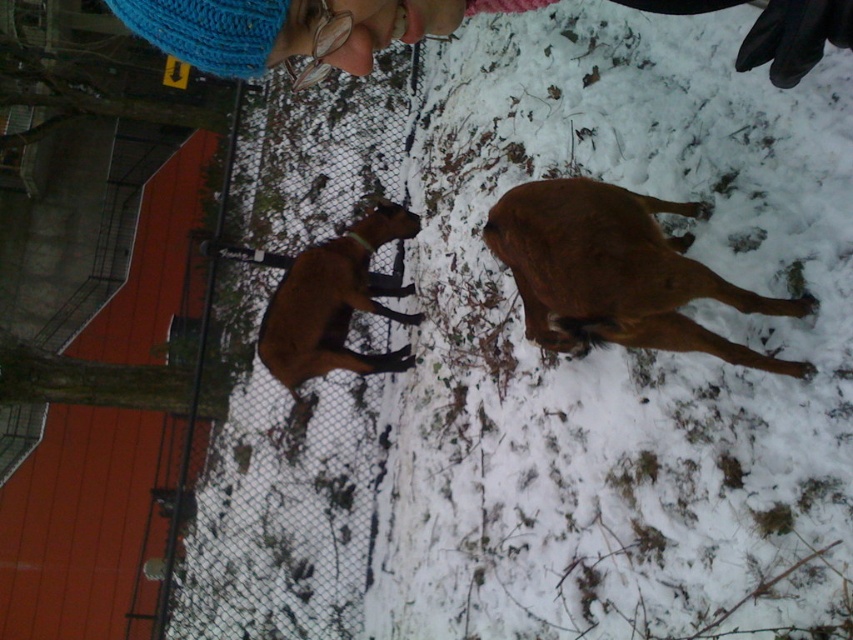
You are a photographer trying to capture a photo of the brown matte dog at center without the metal mesh fence at lower left appearing in the frame. Given their relative sizes, is it possible to adjust your camera angle to exclude the fence?

The metal mesh fence at lower left is narrower than the brown matte dog at center. Since the fence is smaller in width, you can adjust your camera angle to focus solely on the dog while excluding the fence from the shot.

You are a photographer trying to capture both the blue knitted hat at upper center and the brown matte dog at center in a single shot. Based on their positions, which object is closer to the camera?

The blue knitted hat at upper center is shorter than the brown matte dog at center, so the brown matte dog at center is closer to the camera.